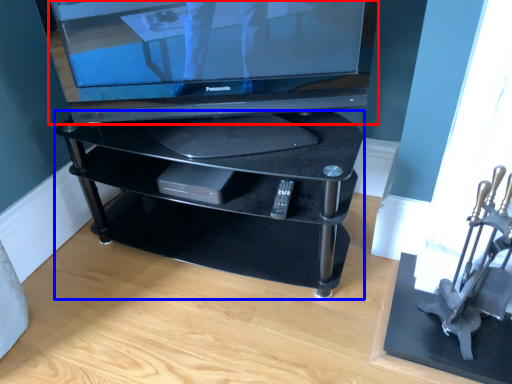
Question: Among these objects, which one is nearest to the camera, television (highlighted by a red box) or furniture (highlighted by a blue box)?

Choices:
 (A) television
 (B) furniture

Answer: (A)